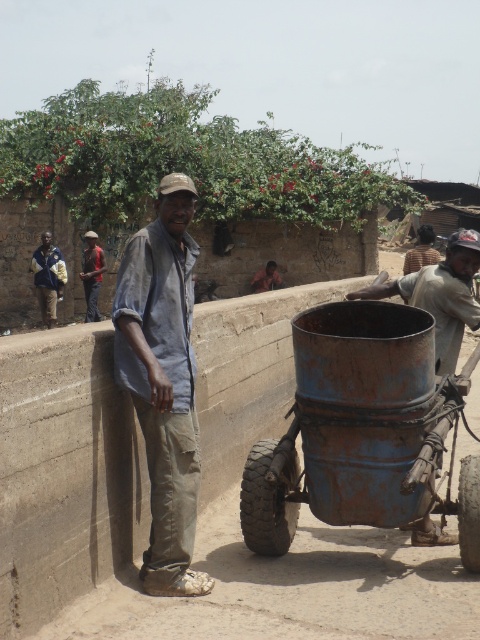
A child wants to throw a ball from the man to the rusty metal wagon at center. The ball can travel 5 meters. Will it reach?

The distance between the man and the rusty metal wagon at center is 4.77 meters, so yes, the ball can reach since it travels 5 meters.